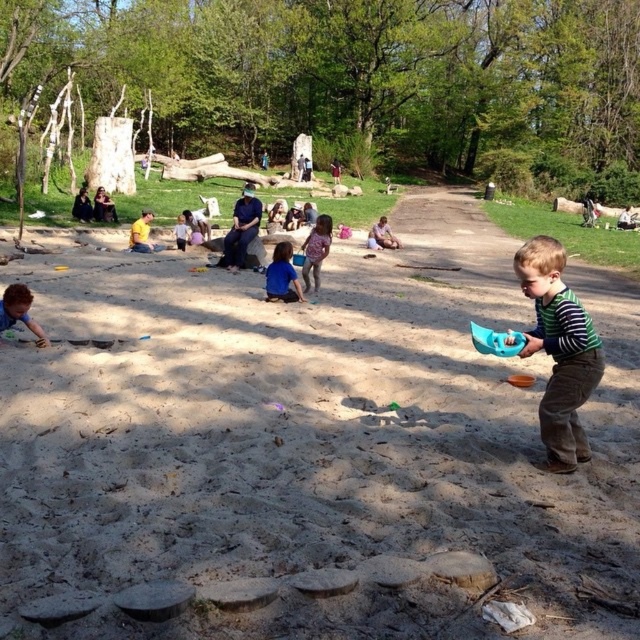
Which of these two, blue rubber boat at right or blue striped shirt at center, stands shorter?

Standing shorter between the two is blue rubber boat at right.

Between blue rubber boat at right and blue striped shirt at center, which one appears on the left side from the viewer's perspective?

blue striped shirt at center

Locate an element on the screen. blue rubber boat at right is located at coordinates (497, 340).

Is point (424, 278) positioned in front of point (525, 342)?

No.

From the picture: Does brown sandy dirt at center have a lesser height compared to blue rubber boat at right?

No.

Which is in front, point (401, 625) or point (499, 348)?

Positioned in front is point (401, 625).

I want to click on brown sandy dirt at center, so click(x=308, y=449).

Who is lower down, brown sandy dirt at center or smooth beige sand at center?

brown sandy dirt at center

Locate an element on the screen. The image size is (640, 640). brown sandy dirt at center is located at coordinates (308, 449).